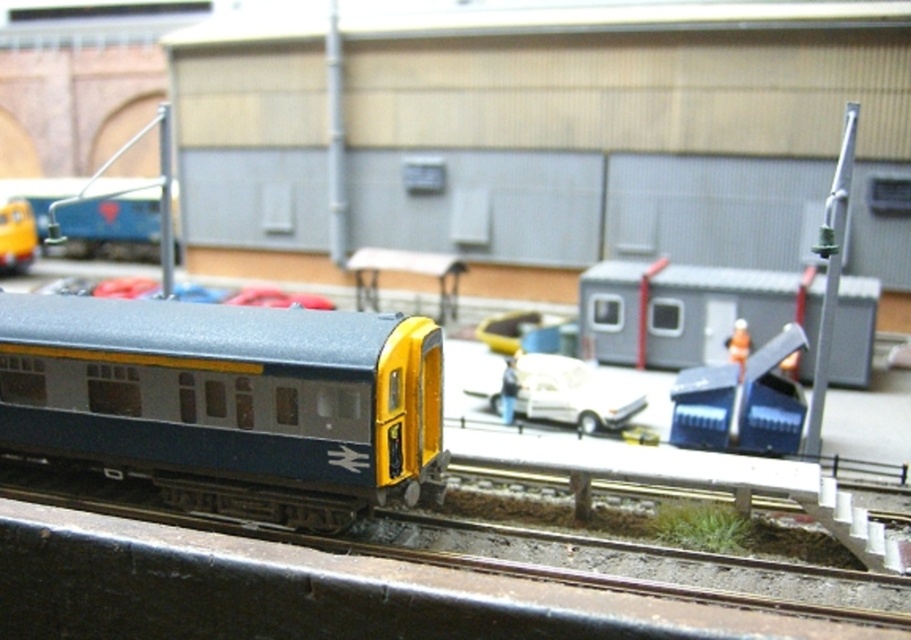
You are standing at the point with coordinates (227, 401) in the model railway scene. What object is exactly at your current location?

The metallic blue train at center is located at point (227, 401).

You are a model railway enthusiast examining the miniature scene. You need to determine if the metallic blue train at center can pass through a tunnel that is exactly the same width as the white matte car at center. Will the train fit?

The metallic blue train at center is wider than the white matte car at center. Since the tunnel is only as wide as the car, the train will not fit through the tunnel.